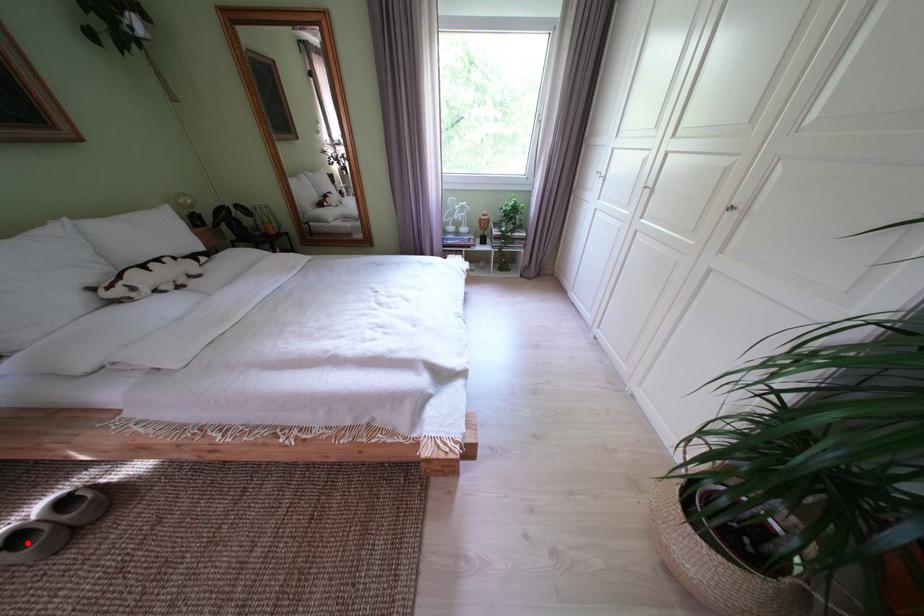
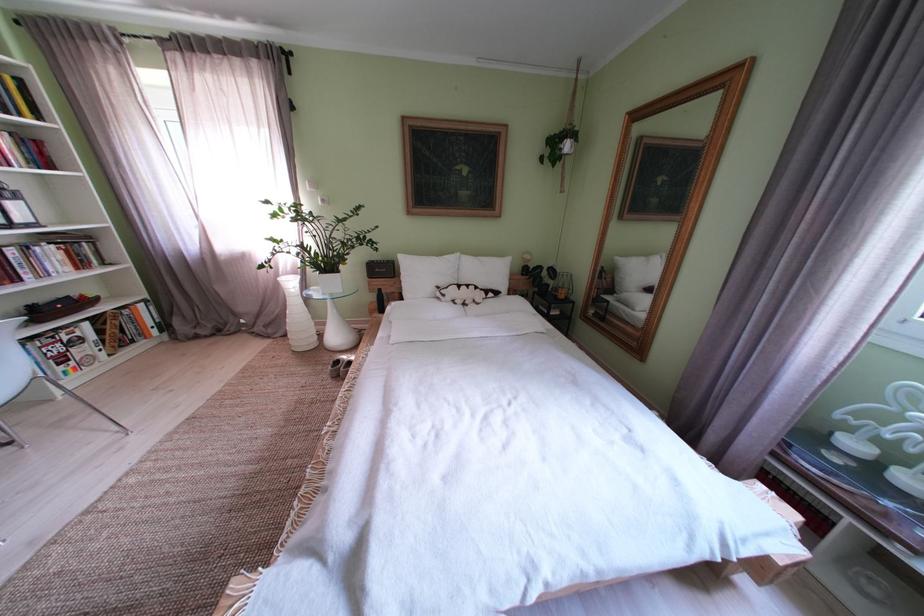
Question: A red point is marked in image1. In image2, is the corresponding 3D point closer to the camera or farther? Reply with the corresponding letter.

Choices:
 (A) The corresponding 3D point is closer.
 (B) The corresponding 3D point is farther.

Answer: (B)